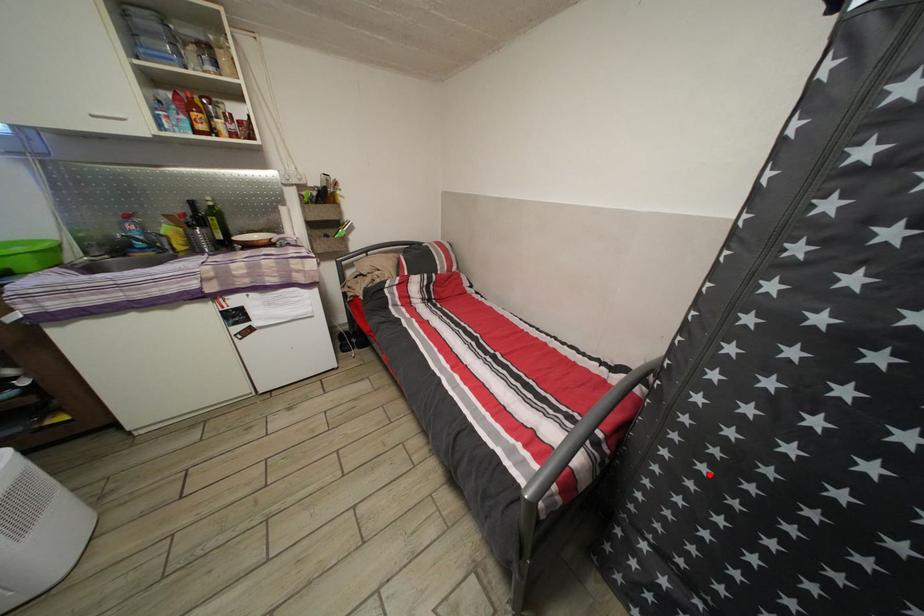
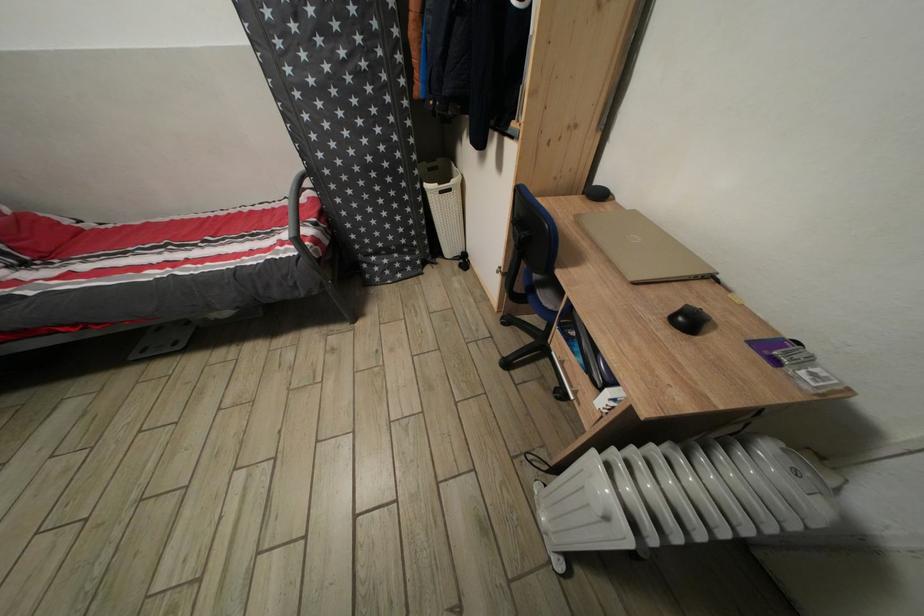
Find the pixel in the second image that matches the highlighted location in the first image.

(357, 198)